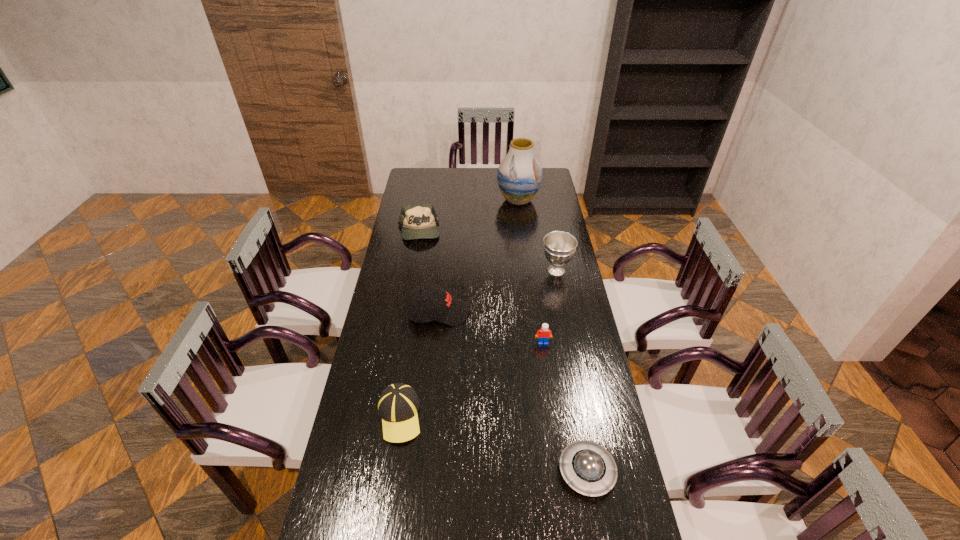
At what (x,y) coordinates should I click in order to perform the action: click on the tallest object. Please return your answer as a coordinate pair (x, y). Image resolution: width=960 pixels, height=540 pixels. Looking at the image, I should click on (519, 175).

I want to click on the farthest object, so click(519, 175).

The height and width of the screenshot is (540, 960). I want to click on the second tallest object, so click(x=559, y=247).

Locate an element on the screen. This screenshot has width=960, height=540. the third farthest object is located at coordinates (559, 247).

Where is `the tallest baseball cap`? This screenshot has width=960, height=540. the tallest baseball cap is located at coordinates (439, 306).

The height and width of the screenshot is (540, 960). Find the location of `the fourth nearest object`. the fourth nearest object is located at coordinates (439, 306).

Where is `Lego`? This screenshot has height=540, width=960. Lego is located at coordinates (543, 335).

Where is `the farthest baseball cap`? This screenshot has width=960, height=540. the farthest baseball cap is located at coordinates (417, 221).

The width and height of the screenshot is (960, 540). What are the coordinates of `the nearest baseball cap` in the screenshot? It's located at (398, 404).

You are a GUI agent. You are given a task and a screenshot of the screen. Output one action in this format:
    pyautogui.click(x=<x>, y=<y>)
    Task: Click on the saucer
    
    Given the screenshot: What is the action you would take?
    pyautogui.click(x=588, y=467)